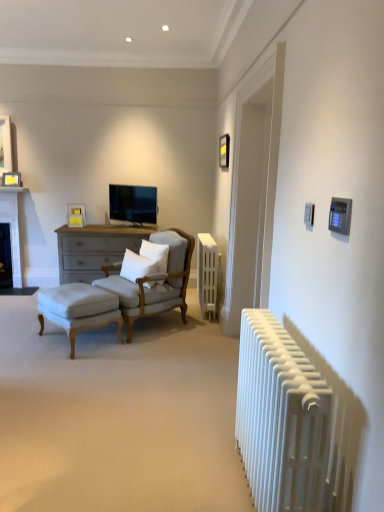
Question: From a real-world perspective, is matte yellow picture frame at upper left, the 1th picture frame from the back, over light beige fabric armchair at center-left?

Choices:
 (A) no
 (B) yes

Answer: (B)

Question: Considering the relative sizes of matte yellow picture frame at upper left, the 3th picture frame when ordered from front to back, and light beige fabric armchair at center-left in the image provided, is matte yellow picture frame at upper left, the 3th picture frame when ordered from front to back, bigger than light beige fabric armchair at center-left?

Choices:
 (A) no
 (B) yes

Answer: (A)

Question: Does matte yellow picture frame at upper left, the 3th picture frame when ordered from front to back, appear on the left side of light beige fabric armchair at center-left?

Choices:
 (A) no
 (B) yes

Answer: (B)

Question: From a real-world perspective, is matte yellow picture frame at upper left, arranged as the second picture frame when viewed from the left, under light beige fabric armchair at center-left?

Choices:
 (A) yes
 (B) no

Answer: (B)

Question: Can you confirm if matte yellow picture frame at upper left, which is counted as the third picture frame, starting from the top, is shorter than light beige fabric armchair at center-left?

Choices:
 (A) no
 (B) yes

Answer: (B)

Question: Can you confirm if matte yellow picture frame at upper left, arranged as the second picture frame when viewed from the left, is smaller than light beige fabric armchair at center-left?

Choices:
 (A) yes
 (B) no

Answer: (A)

Question: Does dark gray stone fireplace at left, acting as the 2th fireplace starting from the top, come behind matte black tv at center?

Choices:
 (A) yes
 (B) no

Answer: (A)

Question: Is dark gray stone fireplace at left, placed as the 1th fireplace when sorted from bottom to top, taller than matte black tv at center?

Choices:
 (A) yes
 (B) no

Answer: (A)

Question: Is dark gray stone fireplace at left, acting as the 2th fireplace starting from the top, positioned in front of matte black tv at center?

Choices:
 (A) yes
 (B) no

Answer: (B)

Question: Is dark gray stone fireplace at left, acting as the 2th fireplace starting from the top, at the left side of matte black tv at center?

Choices:
 (A) yes
 (B) no

Answer: (A)

Question: Does dark gray stone fireplace at left, placed as the 1th fireplace when sorted from bottom to top, have a lesser height compared to matte black tv at center?

Choices:
 (A) no
 (B) yes

Answer: (A)

Question: From the image's perspective, would you say dark gray stone fireplace at left, acting as the 2th fireplace starting from the top, is shown under matte black tv at center?

Choices:
 (A) no
 (B) yes

Answer: (B)

Question: From the image's perspective, is white soft pillow at center, acting as the second pillow starting from the left, located beneath dark gray stone fireplace at left, placed as the 1th fireplace when sorted from bottom to top?

Choices:
 (A) yes
 (B) no

Answer: (A)